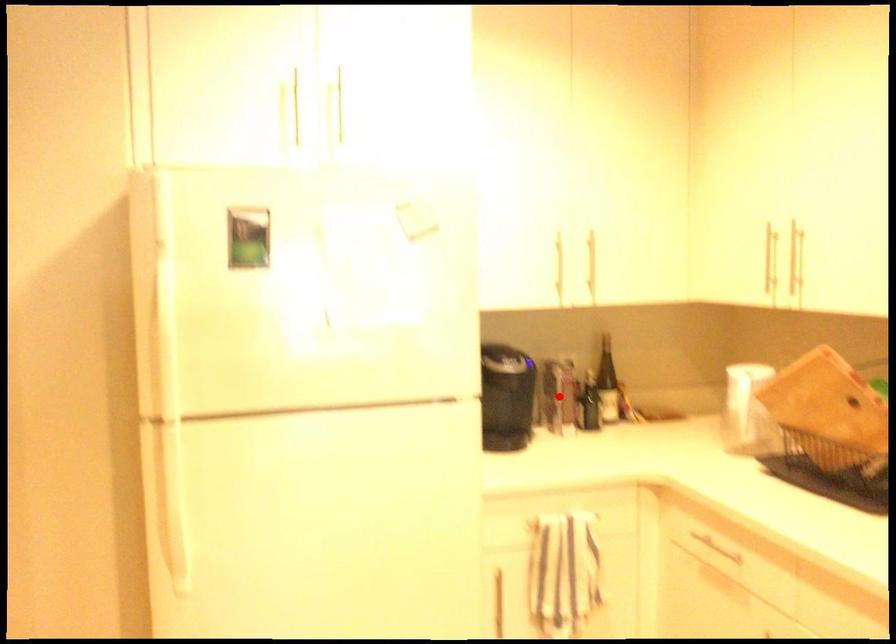
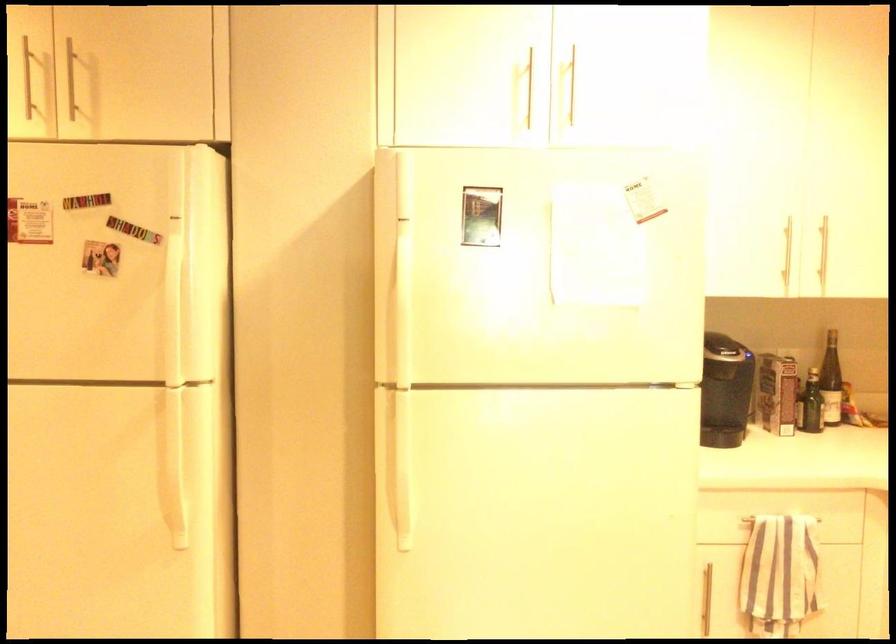
Locate, in the second image, the point that corresponds to the highlighted location in the first image.

(777, 393)